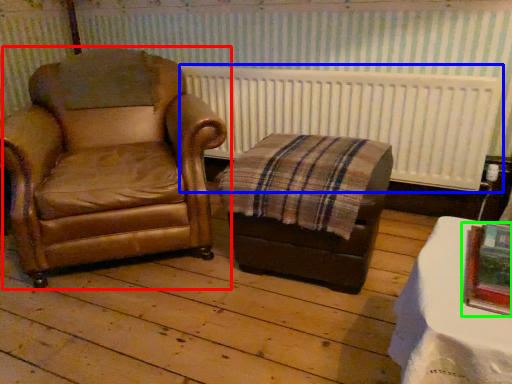
Question: Estimate the real-world distances between objects in this image. Which object is closer to chair (highlighted by a red box), radiator (highlighted by a blue box) or picture frame (highlighted by a green box)?

Choices:
 (A) radiator
 (B) picture frame

Answer: (A)